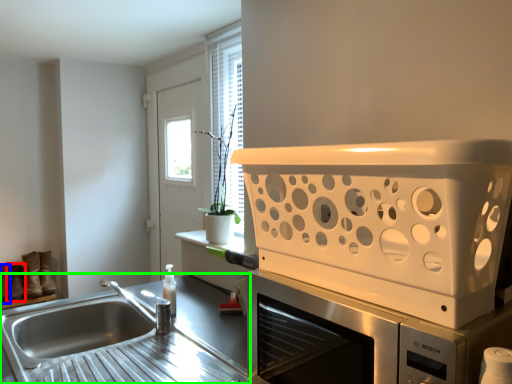
Question: Based on their relative distances, which object is nearer to shoe (highlighted by a red box)? Choose from shoe (highlighted by a blue box) and countertop (highlighted by a green box).

Choices:
 (A) shoe
 (B) countertop

Answer: (A)